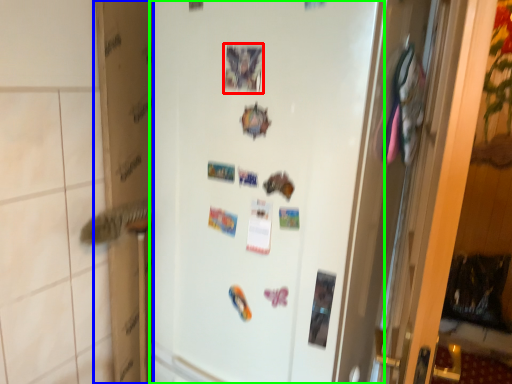
Question: Based on their relative distances, which object is nearer to postcard (highlighted by a red box)? Choose from cardboard box (highlighted by a blue box) and refrigerator (highlighted by a green box).

Choices:
 (A) cardboard box
 (B) refrigerator

Answer: (B)